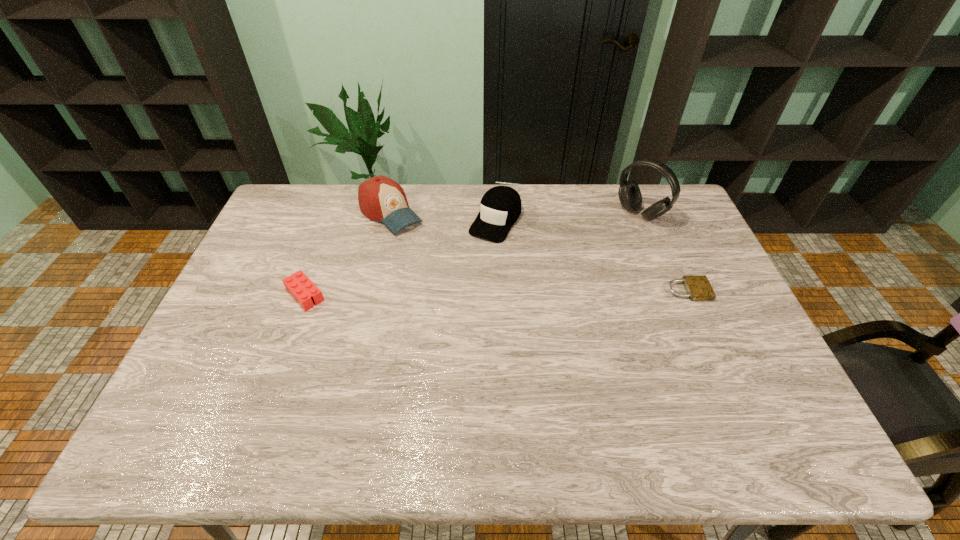
At what (x,y) coordinates should I click in order to perform the action: click on free space between the fourth tallest object and the cap. Please return your answer as a coordinate pair (x, y). The height and width of the screenshot is (540, 960). Looking at the image, I should click on (400, 258).

The image size is (960, 540). I want to click on empty space that is in between the third tallest object and the shortest object, so click(591, 255).

At what (x,y) coordinates should I click in order to perform the action: click on free area in between the tallest object and the shortest object. Please return your answer as a coordinate pair (x, y). This screenshot has height=540, width=960. Looking at the image, I should click on 664,252.

The height and width of the screenshot is (540, 960). I want to click on unoccupied position between the padlock and the tallest object, so click(664, 252).

Locate an element on the screen. The image size is (960, 540). free space between the leftmost object and the headset is located at coordinates (472, 254).

I want to click on empty location between the leftmost object and the padlock, so click(x=496, y=293).

Locate an element on the screen. The image size is (960, 540). empty space between the leftmost object and the tallest object is located at coordinates (472, 254).

You are a GUI agent. You are given a task and a screenshot of the screen. Output one action in this format:
    pyautogui.click(x=<x>, y=<y>)
    Task: Click on the vacant area that lies between the second shortest object and the padlock
    The image size is (960, 540).
    Given the screenshot: What is the action you would take?
    pyautogui.click(x=496, y=293)

Locate which object ranks second in proximity to the leftmost object. Please provide its 2D coordinates. Your answer should be formatted as a tuple, i.e. [(x, y)], where the tuple contains the x and y coordinates of a point satisfying the conditions above.

[(500, 207)]

Identify which object is the fourth nearest to the shortest object. Please provide its 2D coordinates. Your answer should be formatted as a tuple, i.e. [(x, y)], where the tuple contains the x and y coordinates of a point satisfying the conditions above.

[(298, 284)]